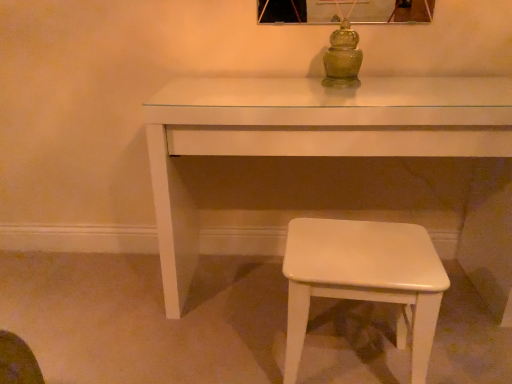
The width and height of the screenshot is (512, 384). I want to click on vacant region to the left of green glass jar at center, so click(278, 85).